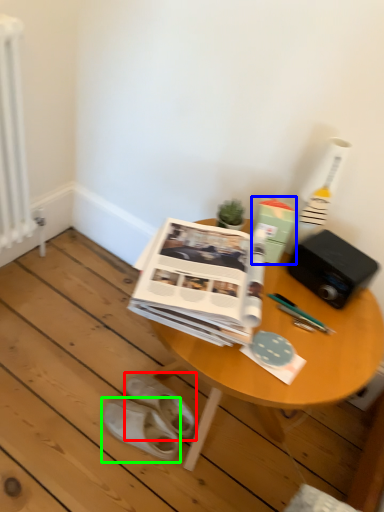
Question: Which object is the closest to the footwear (highlighted by a red box)? Choose among these: paperback book (highlighted by a blue box) or footwear (highlighted by a green box).

Choices:
 (A) paperback book
 (B) footwear

Answer: (B)